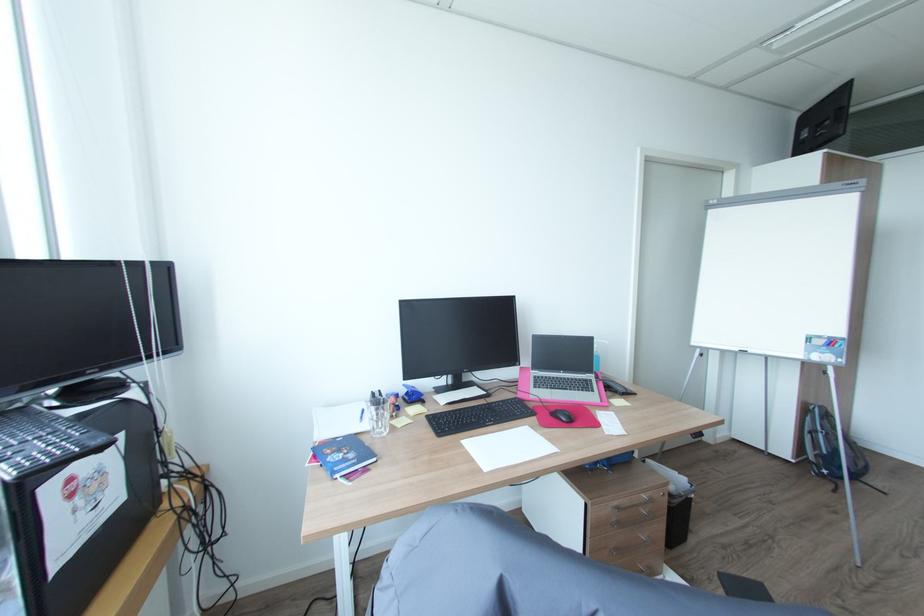
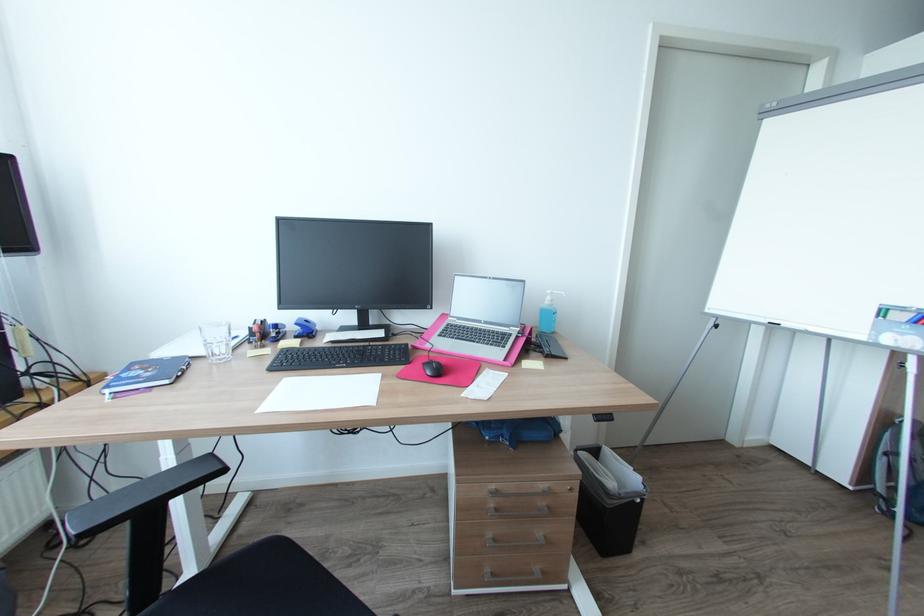
In the second image, find the point that corresponds to (619,504) in the first image.

(497, 487)